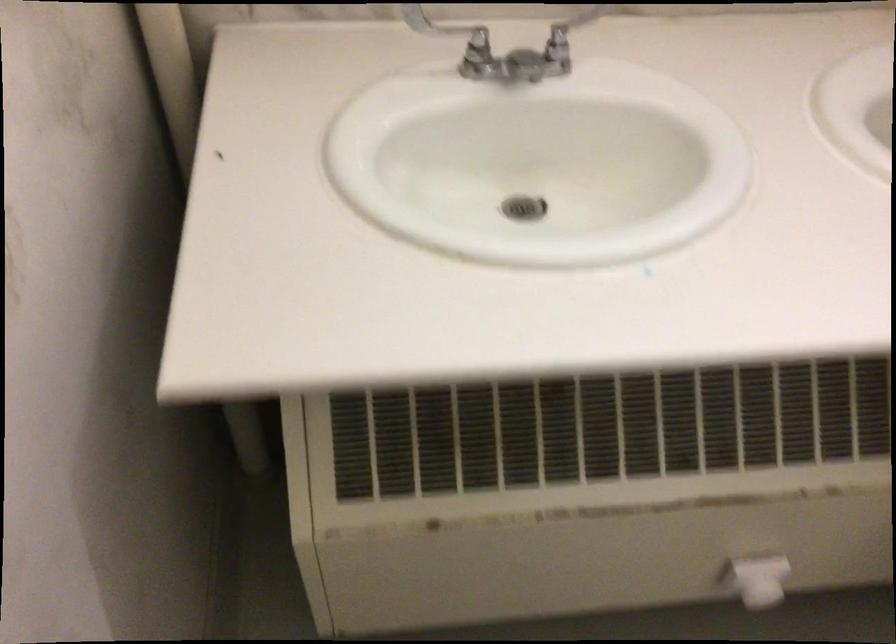
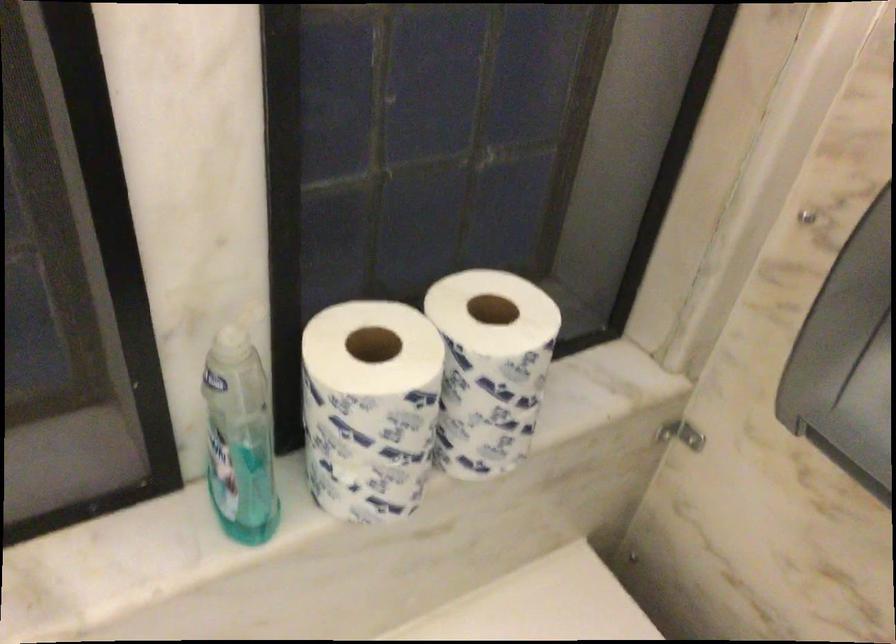
What movement of the cameraman would produce the second image?

The movement direction of the cameraman is right, forward.